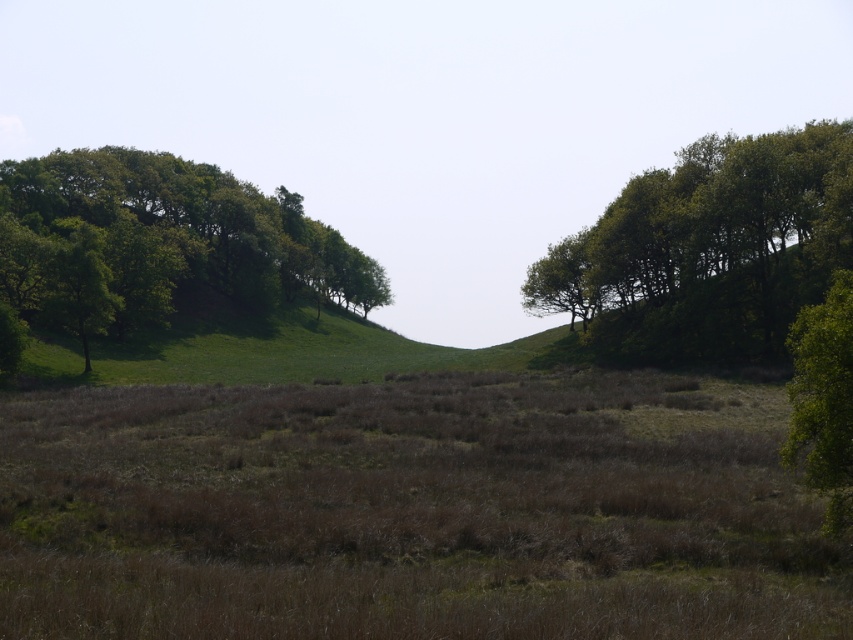
You are standing in the field of dry grass and looking towards the trees. Which tree, the green leafy tree at upper right or the green leafy tree at upper left, appears larger to you?

The green leafy tree at upper right appears larger because it is closer to the viewer than the green leafy tree at upper left.

You are a hiker standing at the center of the field of dry, brownish grasses in the foreground. You see two green leafy trees in the distance. Which tree would you reach first if you walk directly towards the green leafy tree at upper right and the green leafy tree at upper left?

The green leafy tree at upper right is shorter than the green leafy tree at upper left. Since shorter objects may appear closer due to perspective, you would likely reach the green leafy tree at upper right first if both are walked towards directly.

You are standing in the field of dry grasses in the foreground and want to walk towards the green leafy tree at upper right and the green leafy tree at upper left. Which tree will you reach first if you walk directly towards them?

The green leafy tree at upper right has a lesser width compared to the green leafy tree at upper left, so you will reach the green leafy tree at upper right first because it is closer to you.